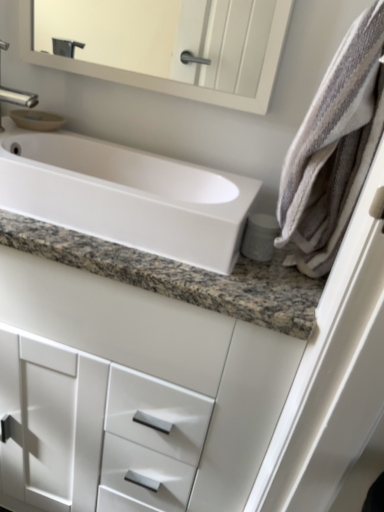
Question: Is white glossy cabinet at center with white glossy sink at center?

Choices:
 (A) yes
 (B) no

Answer: (B)

Question: From the image's perspective, is white glossy cabinet at center on white glossy sink at center?

Choices:
 (A) no
 (B) yes

Answer: (A)

Question: Does white glossy cabinet at center have a greater height compared to white glossy sink at center?

Choices:
 (A) yes
 (B) no

Answer: (A)

Question: Is white glossy cabinet at center at the right side of white glossy sink at center?

Choices:
 (A) no
 (B) yes

Answer: (A)

Question: Considering the relative sizes of white glossy cabinet at center and white glossy sink at center in the image provided, is white glossy cabinet at center shorter than white glossy sink at center?

Choices:
 (A) no
 (B) yes

Answer: (A)

Question: Is white glossy sink at center bigger or smaller than striped cotton bath towel at right?

Choices:
 (A) small
 (B) big

Answer: (B)

Question: In terms of height, does white glossy sink at center look taller or shorter compared to striped cotton bath towel at right?

Choices:
 (A) short
 (B) tall

Answer: (A)

Question: From a real-world perspective, is white glossy sink at center positioned above or below striped cotton bath towel at right?

Choices:
 (A) below
 (B) above

Answer: (A)

Question: Is white glossy sink at center inside or outside of striped cotton bath towel at right?

Choices:
 (A) outside
 (B) inside

Answer: (A)

Question: Looking at their shapes, would you say white glossy cabinet at center is wider or thinner than striped cotton bath towel at right?

Choices:
 (A) wide
 (B) thin

Answer: (A)

Question: Visually, is white glossy cabinet at center positioned to the left or to the right of striped cotton bath towel at right?

Choices:
 (A) left
 (B) right

Answer: (A)

Question: Considering their positions, is white glossy cabinet at center located in front of or behind striped cotton bath towel at right?

Choices:
 (A) behind
 (B) front

Answer: (A)

Question: Is white glossy cabinet at center spatially inside striped cotton bath towel at right, or outside of it?

Choices:
 (A) outside
 (B) inside

Answer: (A)

Question: From a real-world perspective, relative to white glossy sink at center, is striped cotton bath towel at right vertically above or below?

Choices:
 (A) above
 (B) below

Answer: (A)

Question: Considering the relative positions of striped cotton bath towel at right and white glossy sink at center in the image provided, is striped cotton bath towel at right to the left or to the right of white glossy sink at center?

Choices:
 (A) left
 (B) right

Answer: (B)